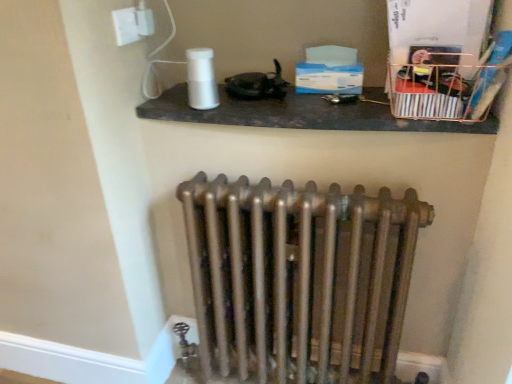
Question: Is metallic wire basket at upper right wider than bronze metallic radiator at center?

Choices:
 (A) yes
 (B) no

Answer: (A)

Question: Is metallic wire basket at upper right at the left side of bronze metallic radiator at center?

Choices:
 (A) yes
 (B) no

Answer: (B)

Question: From a real-world perspective, does metallic wire basket at upper right stand above bronze metallic radiator at center?

Choices:
 (A) yes
 (B) no

Answer: (A)

Question: Does metallic wire basket at upper right lie behind bronze metallic radiator at center?

Choices:
 (A) no
 (B) yes

Answer: (A)

Question: Can you confirm if metallic wire basket at upper right is positioned to the right of bronze metallic radiator at center?

Choices:
 (A) no
 (B) yes

Answer: (B)

Question: Is metallic wire basket at upper right turned away from bronze metallic radiator at center?

Choices:
 (A) no
 (B) yes

Answer: (A)

Question: Does metallic wire basket at upper right lie in front of white glossy shelf at upper center?

Choices:
 (A) yes
 (B) no

Answer: (A)

Question: From the image's perspective, is metallic wire basket at upper right located above white glossy shelf at upper center?

Choices:
 (A) no
 (B) yes

Answer: (B)

Question: From the image's perspective, is metallic wire basket at upper right below white glossy shelf at upper center?

Choices:
 (A) yes
 (B) no

Answer: (B)

Question: Is metallic wire basket at upper right behind white glossy shelf at upper center?

Choices:
 (A) no
 (B) yes

Answer: (A)

Question: Is metallic wire basket at upper right at the right side of white glossy shelf at upper center?

Choices:
 (A) no
 (B) yes

Answer: (B)

Question: Is metallic wire basket at upper right not inside white glossy shelf at upper center?

Choices:
 (A) no
 (B) yes

Answer: (B)

Question: Does white glossy electric outlet at upper left have a lesser height compared to bronze metallic radiator at center?

Choices:
 (A) no
 (B) yes

Answer: (B)